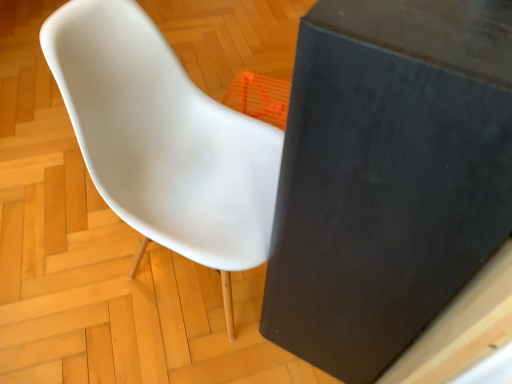
Locate an element on the screen. The height and width of the screenshot is (384, 512). free space in front of white matte chair at center is located at coordinates (167, 353).